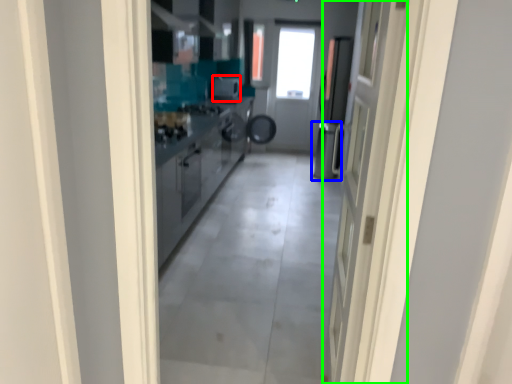
Question: Which object is positioned closest to appliance (highlighted by a red box)? Select from dish washer (highlighted by a blue box) and door (highlighted by a green box).

Choices:
 (A) dish washer
 (B) door

Answer: (A)